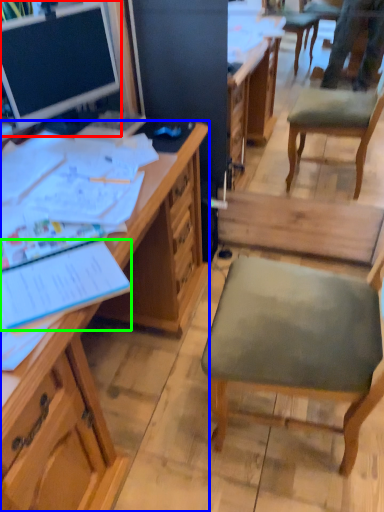
Question: Considering the real-world distances, which object is closest to desk (highlighted by a red box)? desk (highlighted by a blue box) or notebook (highlighted by a green box).

Choices:
 (A) desk
 (B) notebook

Answer: (A)